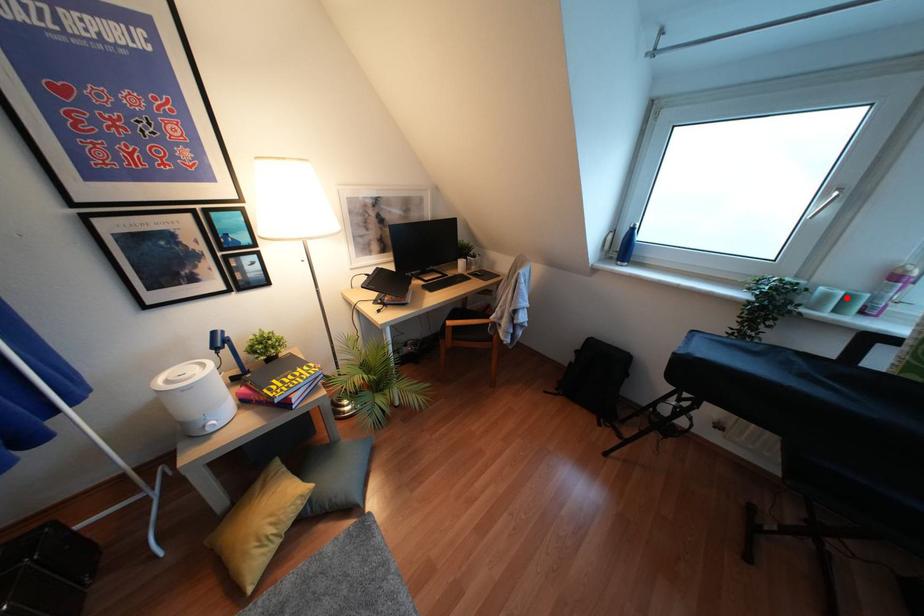
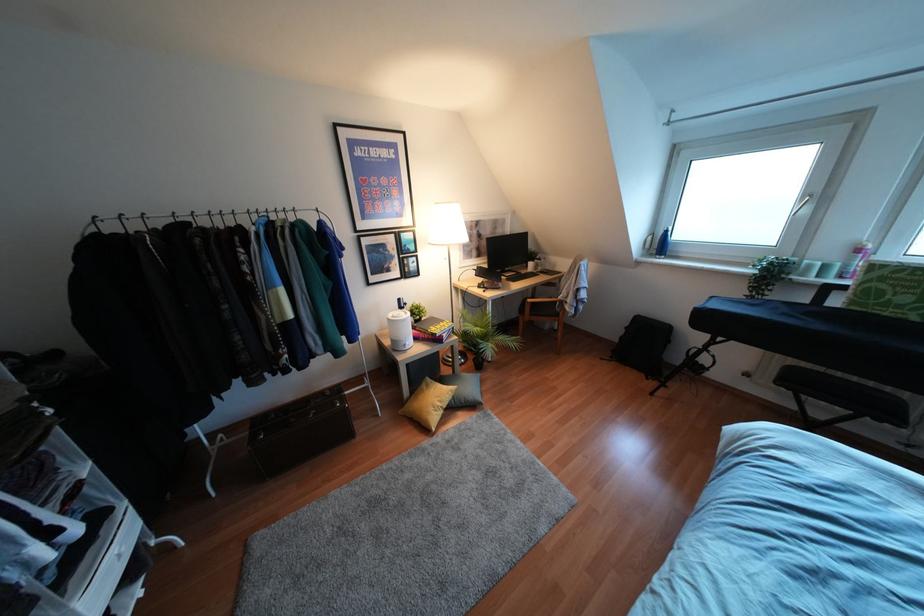
Where in the second image is the point corresponding to the highlighted location from the first image?

(824, 267)